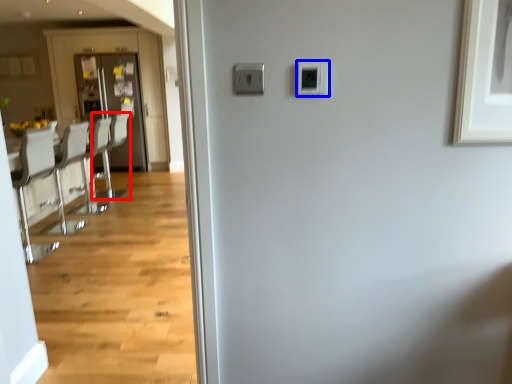
Question: Which point is closer to the camera, armchair (highlighted by a red box) or light switch (highlighted by a blue box)?

Choices:
 (A) armchair
 (B) light switch

Answer: (B)